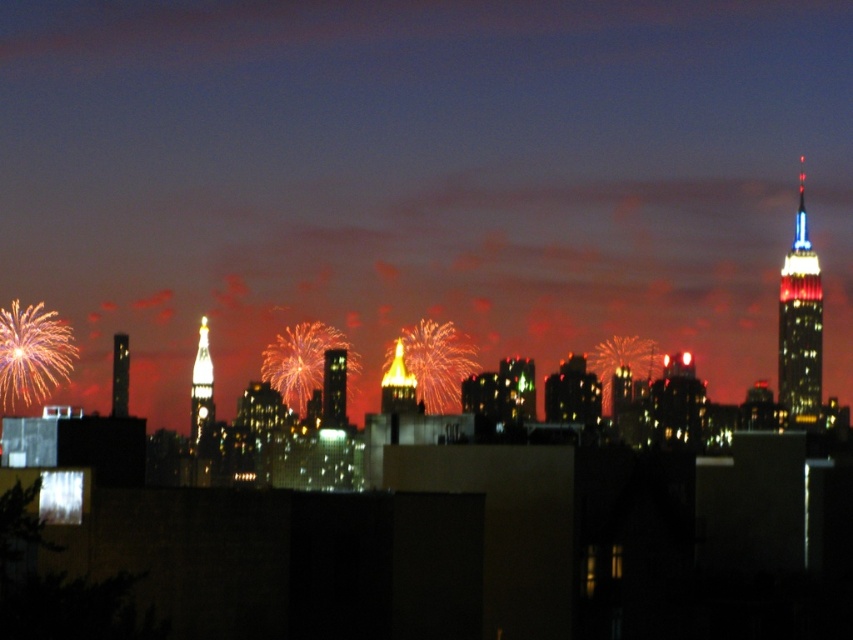
You are a drone operator tasked with capturing aerial footage of the city. Your drone has a maximum flight range of 600 meters. You are currently positioned at the camera location and want to fly the drone to the blue glass skyscraper at right. Can the drone reach the skyscraper without exceeding its maximum range?

The blue glass skyscraper at right is 678.19 meters away from the camera. Since the drone has a maximum flight range of 600 meters, it cannot reach the skyscraper without exceeding its range limit.

From the picture: You are standing on a balcony overlooking the city. You see the shiny glass skyscraper at center and the metallic glass skyscraper at left. Which one is closer to your left side?

The metallic glass skyscraper at left is closer to your left side because it is positioned to the left of the shiny glass skyscraper at center.